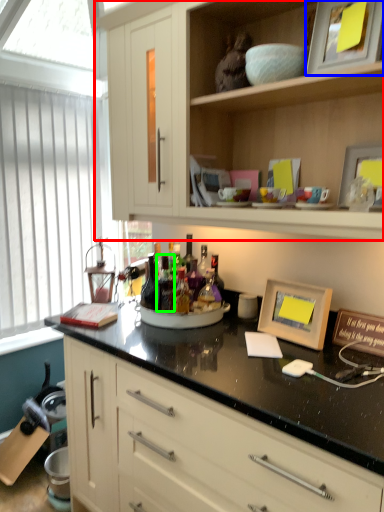
Question: Based on their relative distances, which object is nearer to cabinetry (highlighted by a red box)? Choose from picture frame (highlighted by a blue box) and bottle (highlighted by a green box).

Choices:
 (A) picture frame
 (B) bottle

Answer: (A)